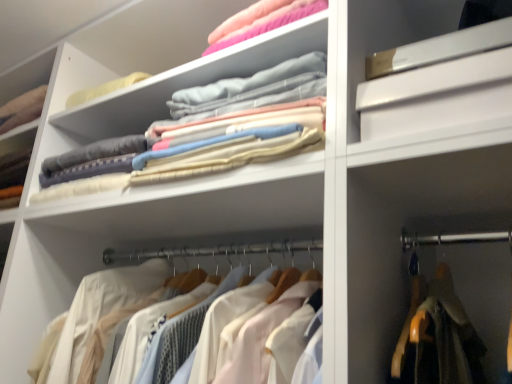
What do you see at coordinates (241, 127) in the screenshot?
I see `pastel cotton shirts at upper center` at bounding box center [241, 127].

At what (x,y) coordinates should I click in order to perform the action: click on pastel cotton shirts at upper center. Please return your answer as a coordinate pair (x, y). This screenshot has width=512, height=384. Looking at the image, I should click on (241, 127).

Locate an element on the screen. This screenshot has width=512, height=384. pastel cotton shirts at upper center is located at coordinates (x=241, y=127).